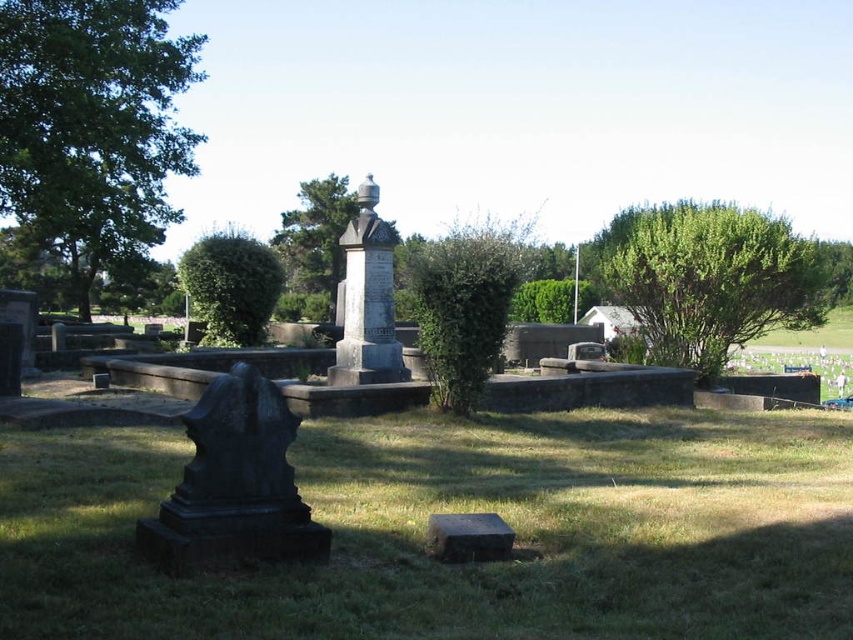
You are visiting the cemetery and want to place a flower on the black granite gravestone at lower center. There is a green leafy bush at center blocking your path. Which direction should you move around the bush to reach the gravestone?

You should move around the green leafy bush at center to the right side since the bush is to the left of the black granite gravestone at lower center.

You are standing at the entrance of the cemetery and want to locate two specific points marked in the image. The first point is at coordinates point [387,312] and the second is at point [437,547]. Which of these two points is closer to you?

Point [387,312] is closer to you because it is further to the viewer than point [437,547].

You are a visitor at the cemetery and want to place a bouquet between the black stone statue at lower left and the granite gravestone at center. Which object should you place the bouquet closer to if you want it to be near the thinner object?

The black stone statue at lower left is thinner than the granite gravestone at center, so you should place the bouquet closer to the black stone statue at lower left.